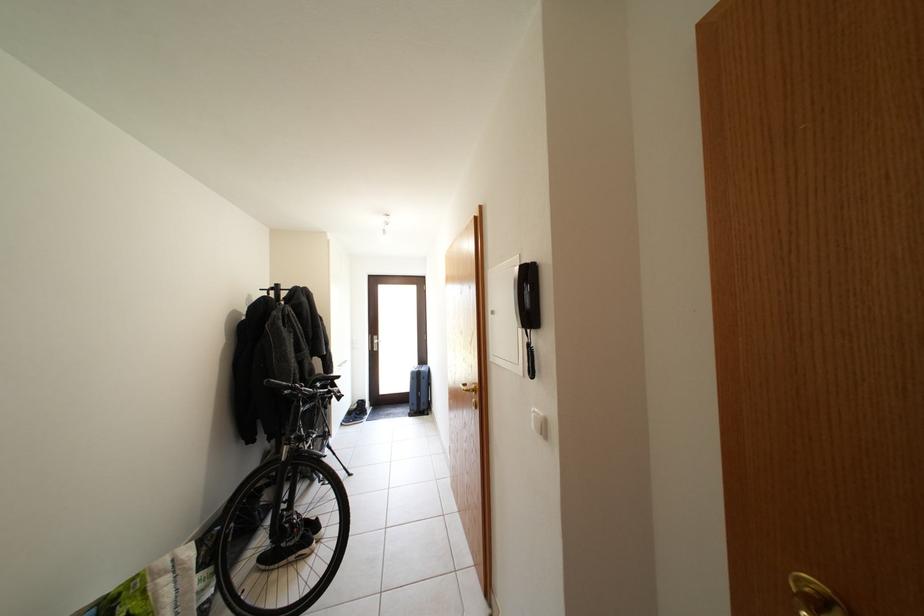
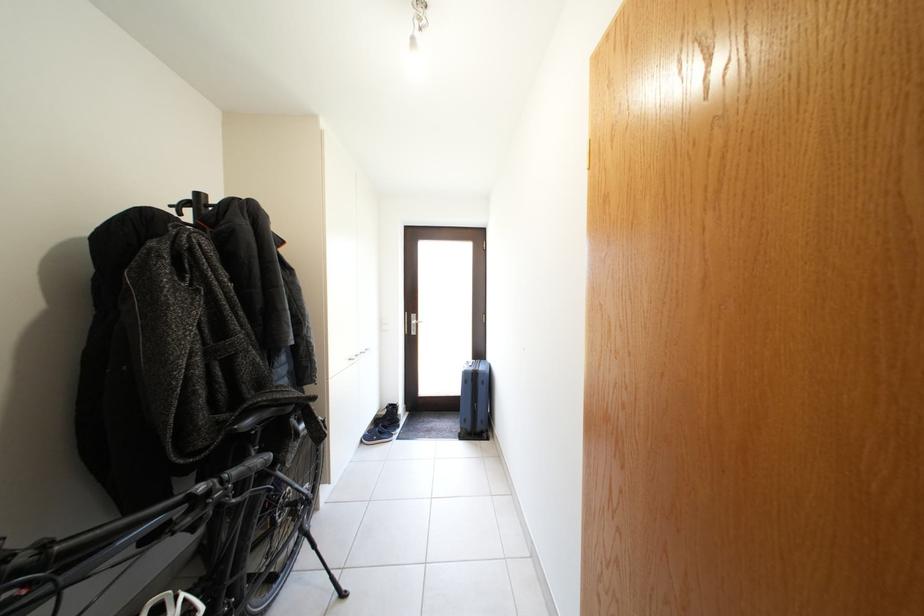
In the second image, find the point that corresponds to point (420, 379) in the first image.

(473, 379)